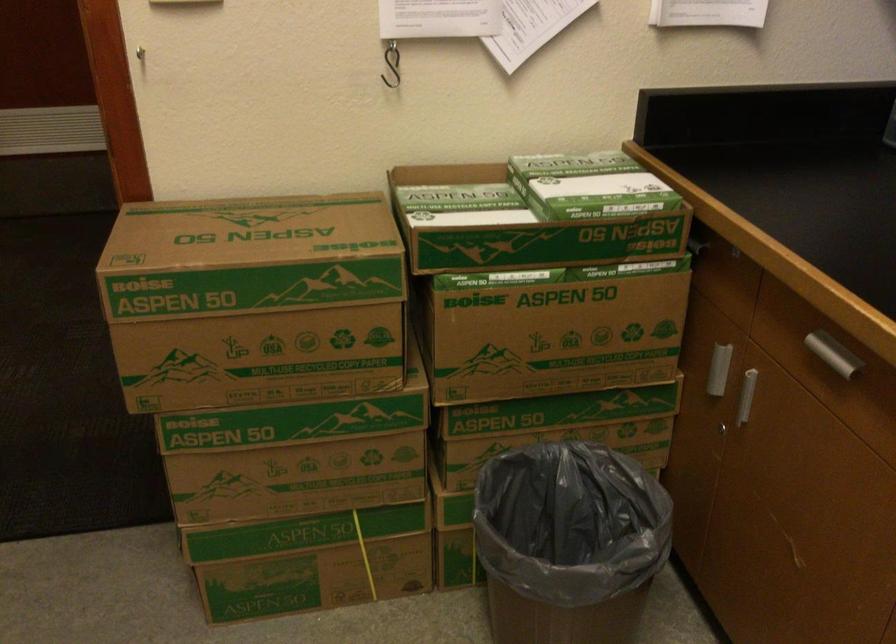
Identify the location of silver cabinet handle. (831, 353).